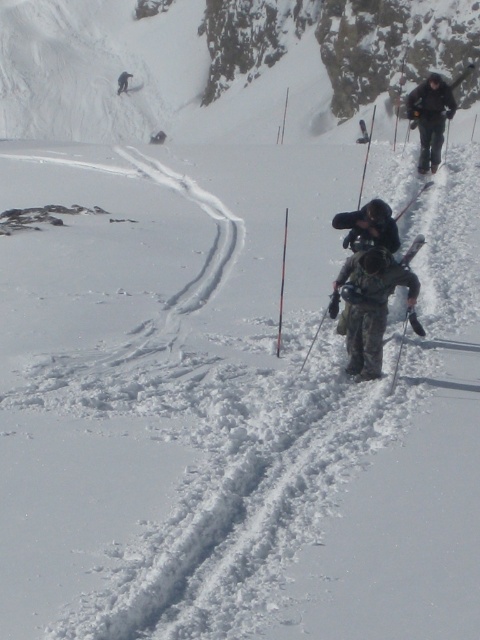
You are an observer standing at the bottom of the mountain looking up. You see a camouflage fabric jacket at center and a black matte backpack at center. Which object is positioned more to the right?

The camouflage fabric jacket at center is to the right of the black matte backpack at center.

You are a photographer standing at the camera position in the snowy mountain scene. You want to take a photo of the black fabric jacket at upper right. Is the jacket within a 25 meter range of your camera?

The black fabric jacket at upper right and camera are 25.57 meters apart, which exceeds the 25 meter range. Therefore, the jacket is slightly out of range for the camera.